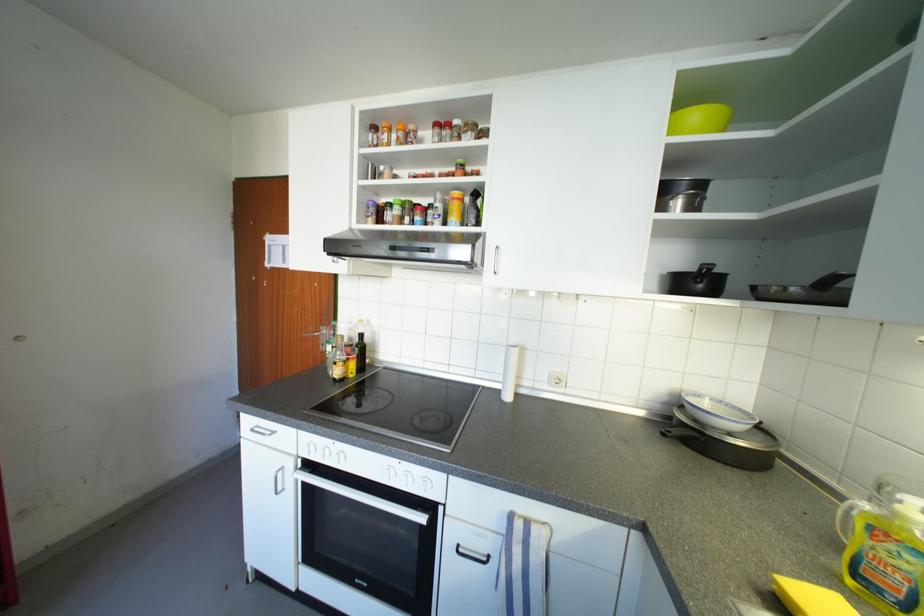
I want to click on white and blue bowl, so click(x=716, y=413).